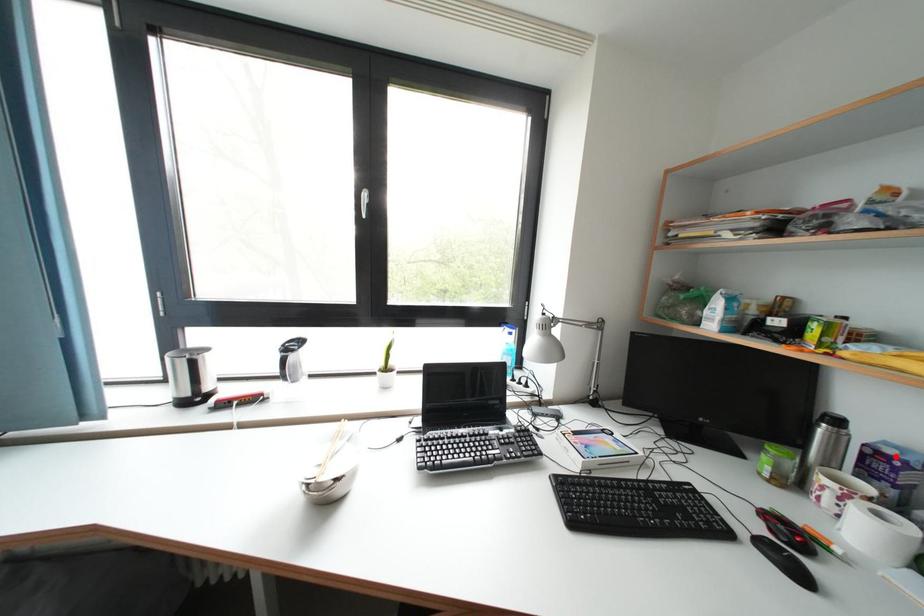
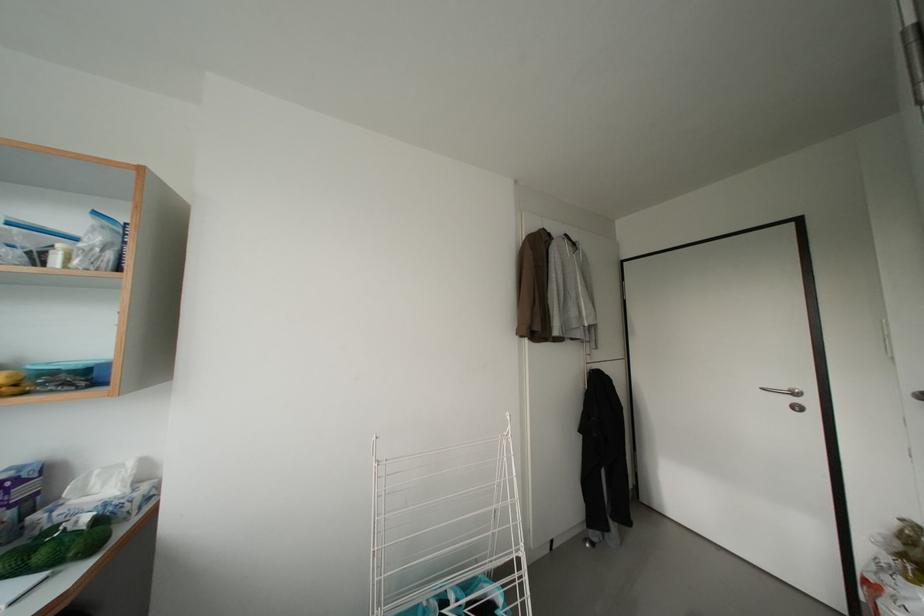
Locate, in the second image, the point that corresponds to the highlighted location in the first image.

(11, 482)